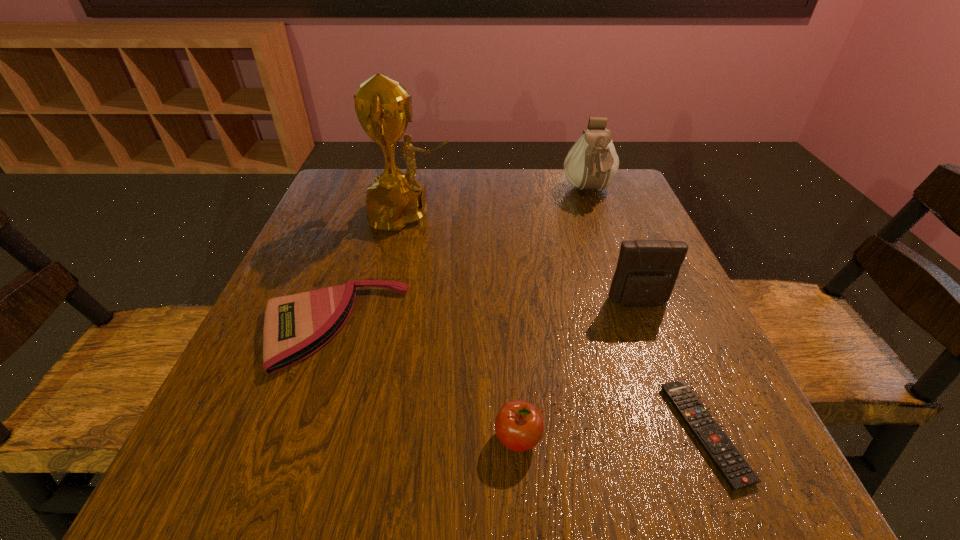
Identify the location of the tallest object. The width and height of the screenshot is (960, 540). (383, 107).

Locate an element on the screen. The height and width of the screenshot is (540, 960). the farther pouch is located at coordinates (592, 163).

You are a GUI agent. You are given a task and a screenshot of the screen. Output one action in this format:
    pyautogui.click(x=<x>, y=<y>)
    Task: Click on the second tallest object
    This screenshot has height=540, width=960.
    Given the screenshot: What is the action you would take?
    pyautogui.click(x=592, y=163)

The image size is (960, 540). What are the coordinates of `the shorter pouch` in the screenshot? It's located at (647, 270).

At what (x,y) coordinates should I click in order to perform the action: click on the third tallest object. Please return your answer as a coordinate pair (x, y). The image size is (960, 540). Looking at the image, I should click on (647, 270).

Find the location of a particular element. the third object from left to right is located at coordinates (519, 425).

Where is `the fourth tallest object`? the fourth tallest object is located at coordinates (519, 425).

Locate an element on the screen. the second shortest object is located at coordinates (295, 326).

Locate an element on the screen. The image size is (960, 540). the shortest object is located at coordinates (735, 470).

Where is `free space located on the front side of the tallest object`? free space located on the front side of the tallest object is located at coordinates (620, 214).